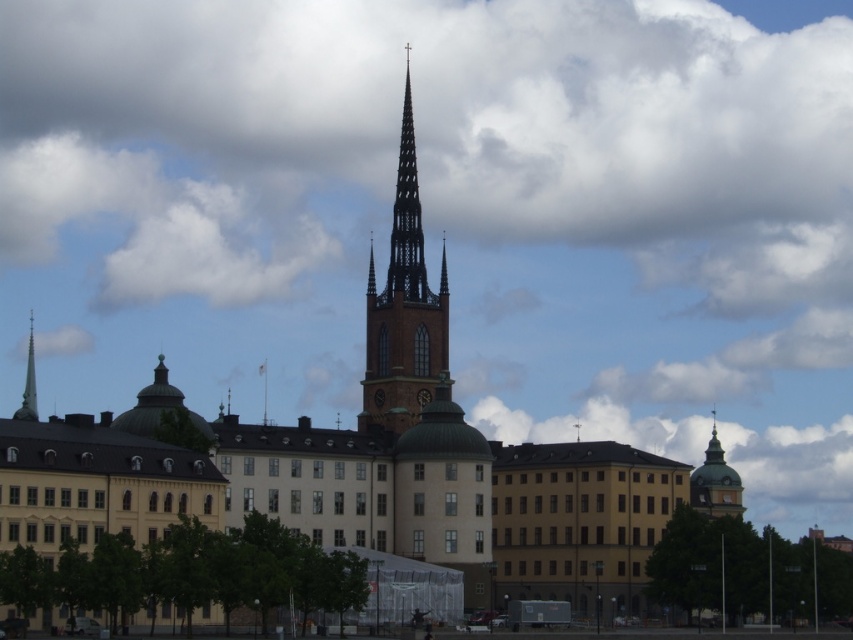
You are a drone operator planning to fly a drone between the green domed tower at upper right and the smooth silver spire at left. The drone has a maximum flight distance of 50 meters. Can the drone safely make the trip between these two landmarks without exceeding its range?

The green domed tower at upper right and smooth silver spire at left are 47.49 meters apart. Since the drone has a maximum flight distance of 50 meters, it can safely make the trip between these two landmarks without exceeding its range.

What are the coordinates of the brown stone bell tower at center?

The coordinates of the brown stone bell tower at center are point [403,308].